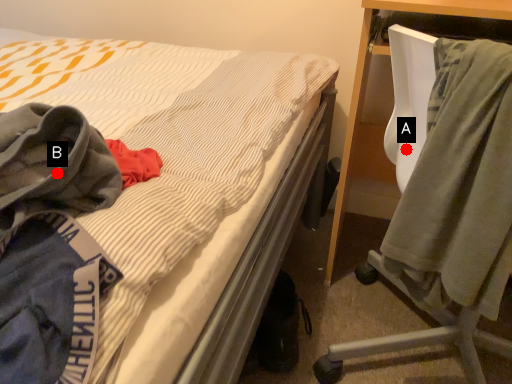
Question: Two points are circled on the image, labeled by A and B beside each circle. Which point appears farthest from the camera in this image?

Choices:
 (A) A is further
 (B) B is further

Answer: (A)